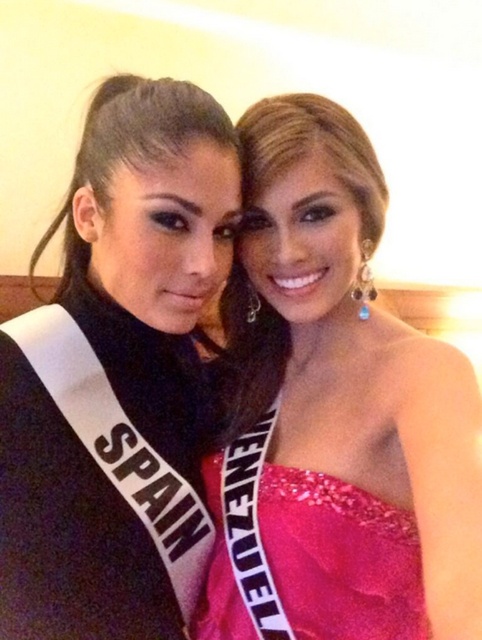
Question: Which of the following is the farthest from the observer?

Choices:
 (A) (42, 497)
 (B) (338, 397)
 (C) (263, 536)

Answer: (B)

Question: Among these points, which one is nearest to the camera?

Choices:
 (A) (406, 451)
 (B) (145, 346)
 (C) (262, 493)

Answer: (A)

Question: Does pink satin dress at center appear on the left side of pink sequined dress at center?

Choices:
 (A) no
 (B) yes

Answer: (A)

Question: Which point is farther from the camera taking this photo?

Choices:
 (A) tap(371, 602)
 (B) tap(0, 465)

Answer: (A)

Question: Can you confirm if pink satin dress at center is positioned to the right of black satin sash at left?

Choices:
 (A) no
 (B) yes

Answer: (B)

Question: Is black satin sash at left wider than pink sequined dress at center?

Choices:
 (A) no
 (B) yes

Answer: (B)